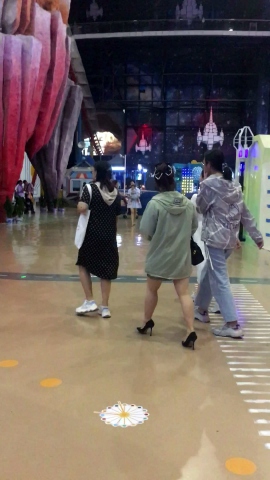
Find the location of a particular element. lighting is located at coordinates (104, 138), (141, 167), (186, 184), (123, 168).